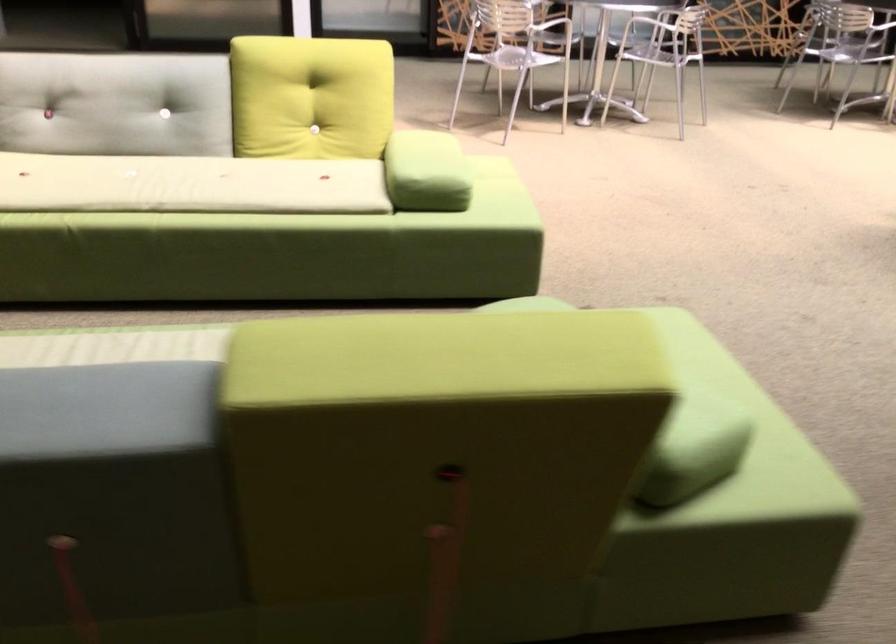
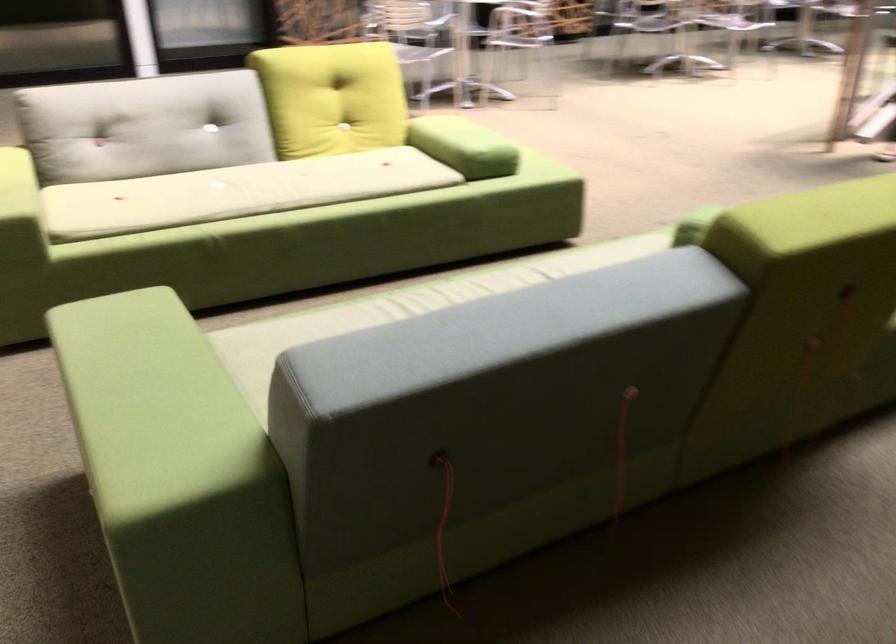
Locate, in the second image, the point that corresponds to [93,350] in the first image.

(401, 308)